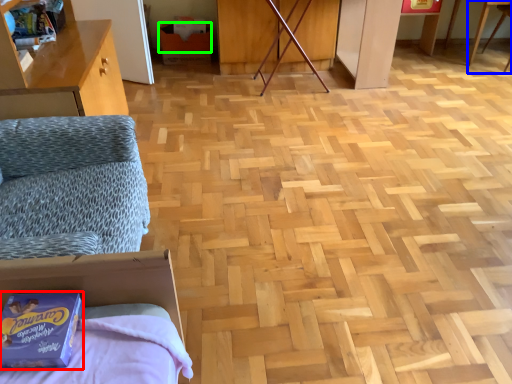
Question: Estimate the real-world distances between objects in this image. Which object is closer to package (highlighted by a red box), table (highlighted by a blue box) or cardboard box (highlighted by a green box)?

Choices:
 (A) table
 (B) cardboard box

Answer: (B)